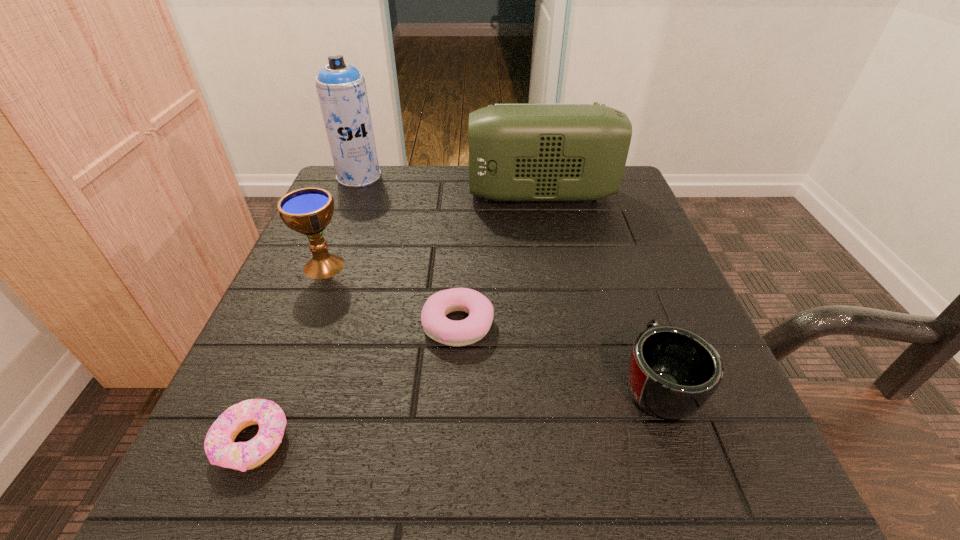
Locate an element on the screen. aerosol can that is at the left edge is located at coordinates (341, 88).

Identify the location of chalice located at the left edge. (308, 211).

The height and width of the screenshot is (540, 960). What are the coordinates of `doughnut that is at the left edge` in the screenshot? It's located at (219, 445).

Where is `radio_receiver present at the right edge`? radio_receiver present at the right edge is located at coordinates (517, 151).

Locate an element on the screen. This screenshot has height=540, width=960. mug that is positioned at the right edge is located at coordinates (672, 372).

Locate an element on the screen. This screenshot has height=540, width=960. object located in the far left corner section of the desktop is located at coordinates (341, 88).

The height and width of the screenshot is (540, 960). In order to click on object located in the near left corner section of the desktop in this screenshot , I will do `click(219, 445)`.

This screenshot has height=540, width=960. Find the location of `object located in the far right corner section of the desktop`. object located in the far right corner section of the desktop is located at coordinates (517, 151).

Where is `free space at the far edge`? free space at the far edge is located at coordinates (430, 186).

Locate an element on the screen. This screenshot has height=540, width=960. vacant space at the near edge of the desktop is located at coordinates (458, 489).